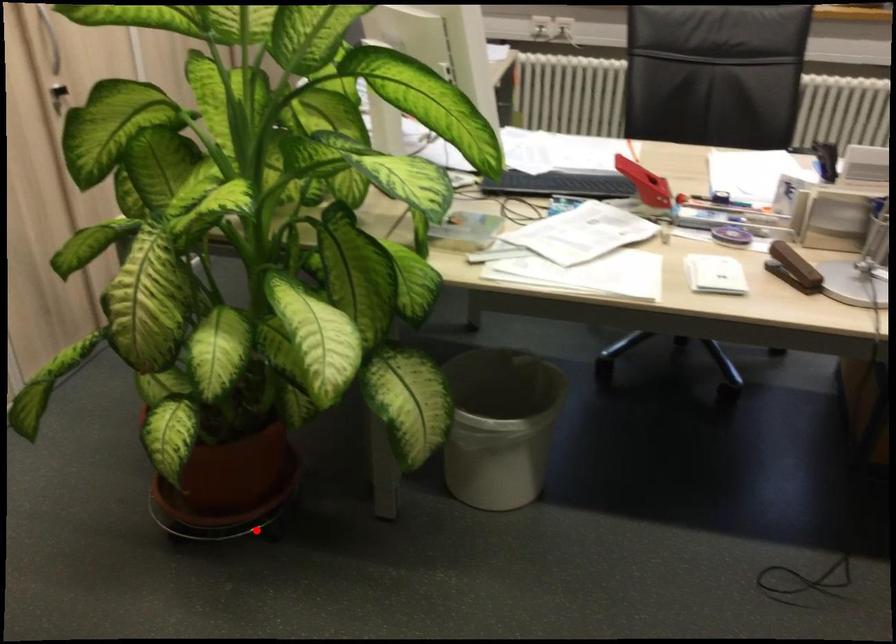
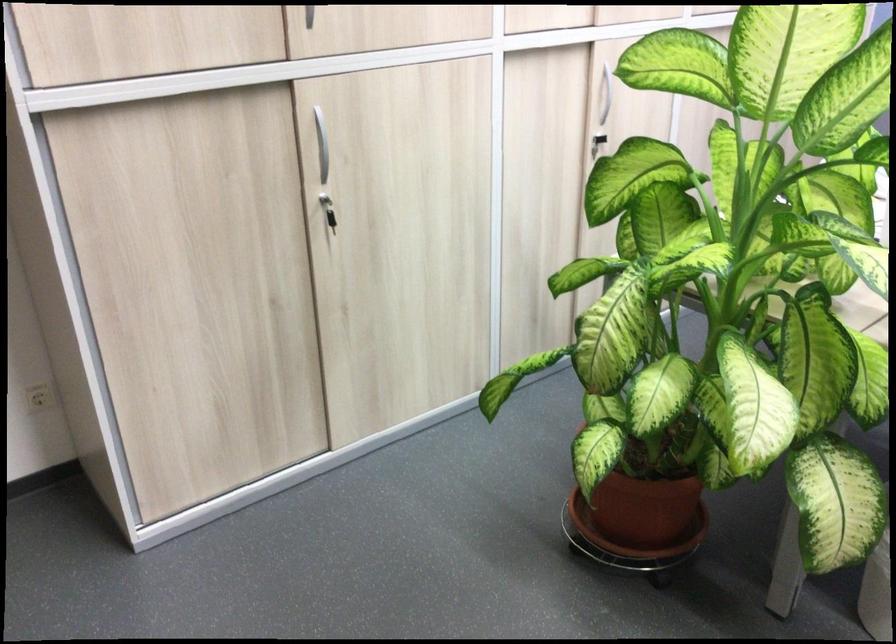
Locate, in the second image, the point that corresponds to the highlighted location in the first image.

(636, 564)